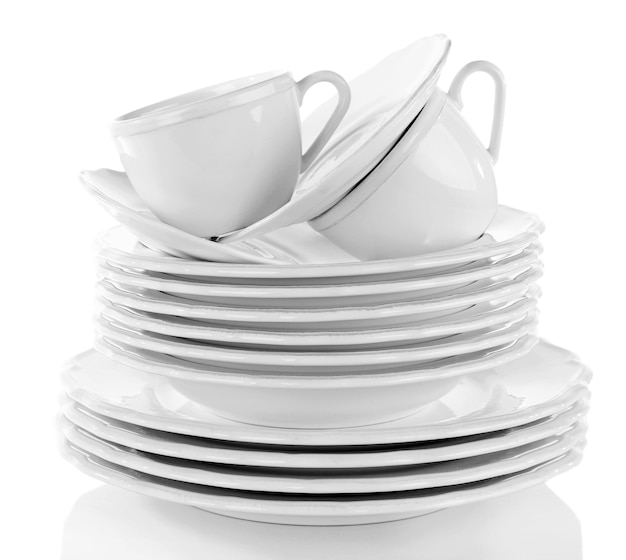
Find the location of a particular element. The height and width of the screenshot is (560, 626). plates is located at coordinates (285, 514), (274, 480), (274, 464), (227, 430), (177, 239), (304, 202).